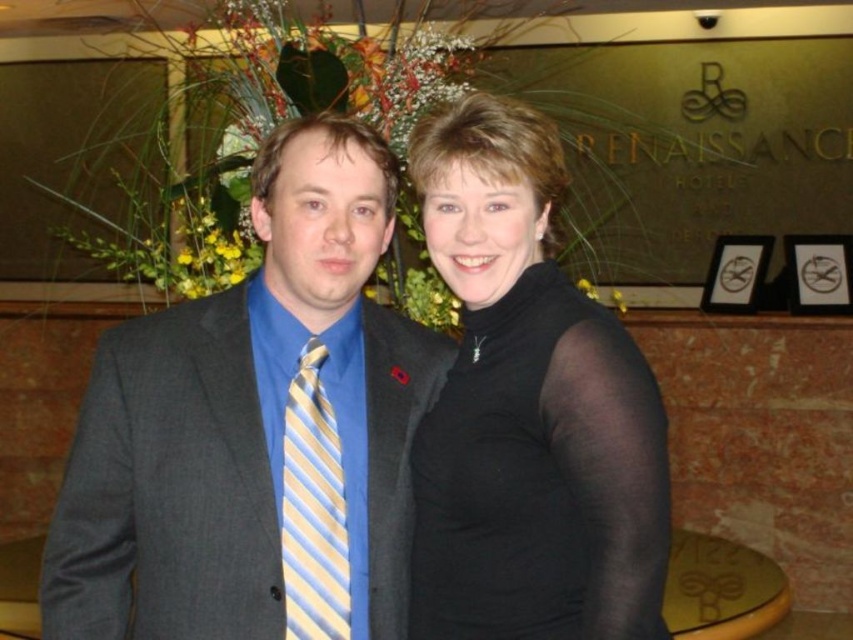
Question: Which point is farther from the camera taking this photo?

Choices:
 (A) (364, 428)
 (B) (318, 588)
 (C) (605, 512)

Answer: (A)

Question: In this image, where is matte gray suit at center located relative to yellow and blue striped tie at left?

Choices:
 (A) above
 (B) below

Answer: (A)

Question: Is matte gray suit at center below yellow and blue striped tie at left?

Choices:
 (A) yes
 (B) no

Answer: (B)

Question: In this image, where is matte gray suit at center located relative to black matte turtleneck at center?

Choices:
 (A) left
 (B) right

Answer: (A)

Question: Which object appears closest to the camera in this image?

Choices:
 (A) black matte turtleneck at center
 (B) matte gray suit at center

Answer: (A)

Question: Which object is positioned farthest from the matte gray suit at center?

Choices:
 (A) black matte turtleneck at center
 (B) yellow and blue striped tie at left

Answer: (A)